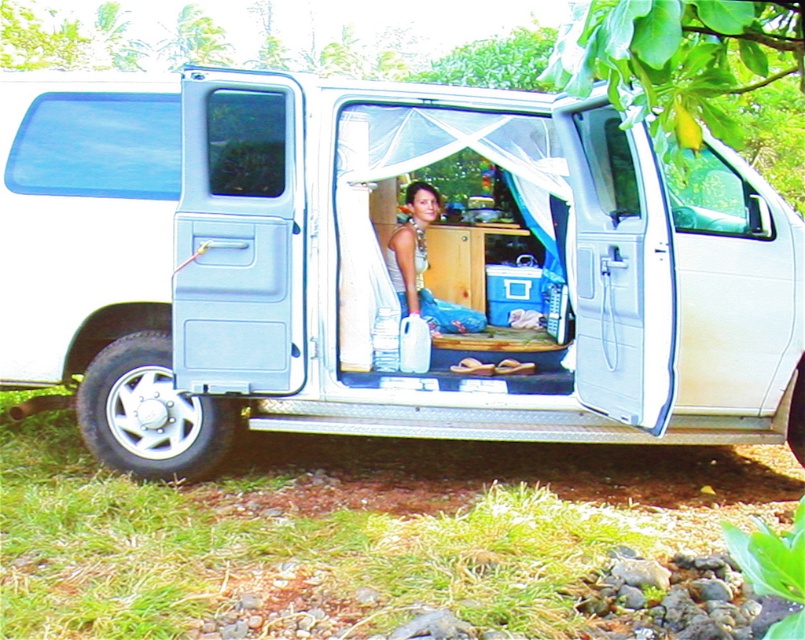
From the picture: Which of these two, light blue plastic door at center or white plastic door at right, stands shorter?

With less height is light blue plastic door at center.

Is point (201, 246) closer to viewer compared to point (638, 260)?

No, (201, 246) is behind (638, 260).

Which is in front, point (240, 145) or point (605, 122)?

Positioned in front is point (605, 122).

The image size is (805, 640). I want to click on light blue plastic door at center, so click(238, 234).

Can you confirm if white matte van at center is smaller than white plastic door at right?

No, white matte van at center is not smaller than white plastic door at right.

Image resolution: width=805 pixels, height=640 pixels. In order to click on white matte van at center in this screenshot , I will do (378, 268).

Which is in front, point (308, 148) or point (250, 240)?

Point (250, 240) is more forward.

Does white matte van at center come in front of light blue plastic door at center?

Yes, white matte van at center is in front of light blue plastic door at center.

Between point (143, 179) and point (213, 216), which one is positioned in front?

Positioned in front is point (213, 216).

Locate an element on the screen. white matte van at center is located at coordinates (378, 268).